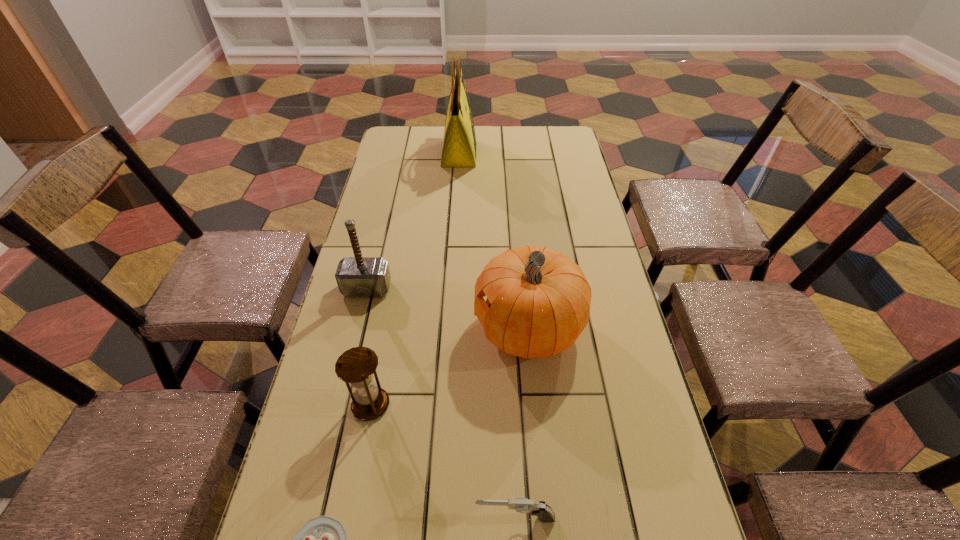
This screenshot has width=960, height=540. In order to click on the farthest object in this screenshot , I will do `click(459, 143)`.

Image resolution: width=960 pixels, height=540 pixels. Find the location of `the tallest object`. the tallest object is located at coordinates (459, 143).

Where is `pumpkin`? Image resolution: width=960 pixels, height=540 pixels. pumpkin is located at coordinates (538, 301).

Where is `hammer`? This screenshot has height=540, width=960. hammer is located at coordinates (357, 276).

The width and height of the screenshot is (960, 540). Identify the location of hourglass. (356, 366).

Where is `the fourth farthest object`? The width and height of the screenshot is (960, 540). the fourth farthest object is located at coordinates (356, 366).

Where is `gun`? gun is located at coordinates (544, 512).

Image resolution: width=960 pixels, height=540 pixels. I want to click on free space located 0.220m on the front-facing side of the tallest object, so click(x=532, y=154).

The width and height of the screenshot is (960, 540). In order to click on free location located on the front-facing side of the pumpkin in this screenshot , I will do `click(351, 329)`.

Where is `vacant area situated 0.280m on the front-facing side of the pumpkin`? vacant area situated 0.280m on the front-facing side of the pumpkin is located at coordinates (367, 329).